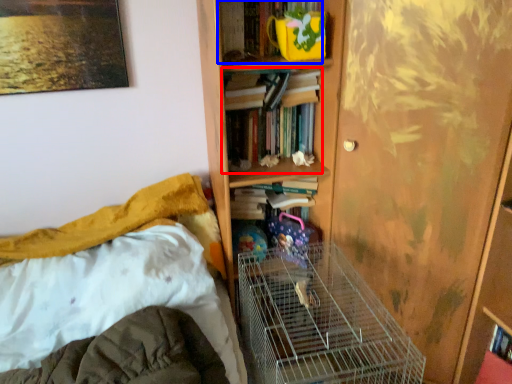
Question: Which object is further to the camera taking this photo, book (highlighted by a red box) or book (highlighted by a blue box)?

Choices:
 (A) book
 (B) book

Answer: (A)